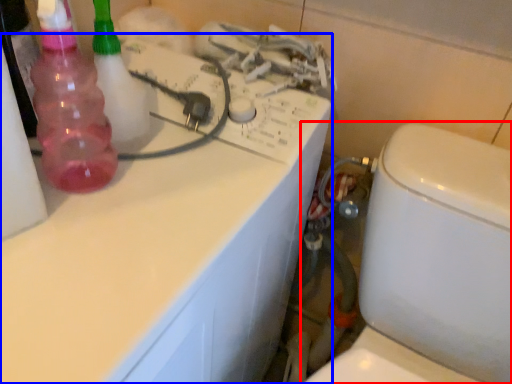
Question: Which object appears farthest to the camera in this image, toilet (highlighted by a red box) or counter top (highlighted by a blue box)?

Choices:
 (A) toilet
 (B) counter top

Answer: (B)